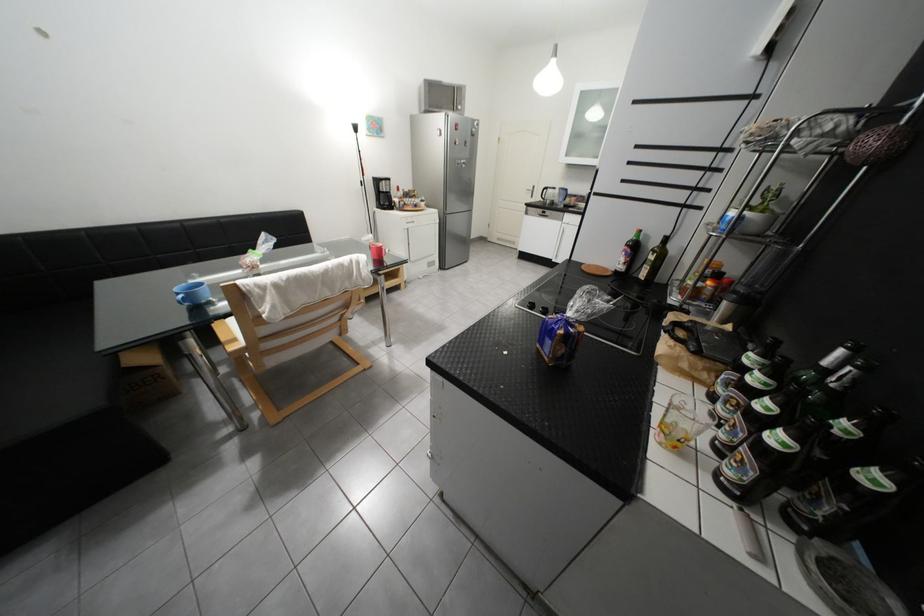
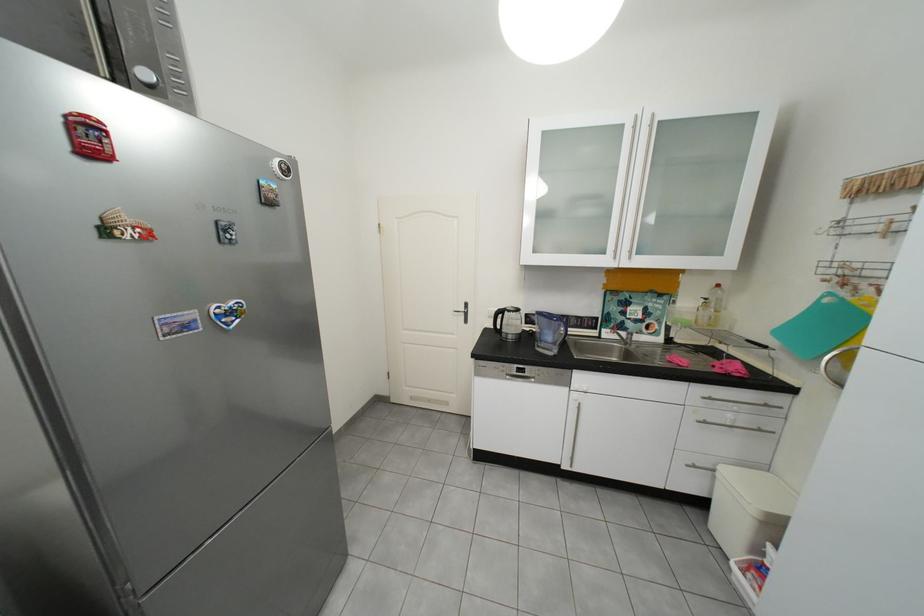
Find the pixel in the second image that matches (557,190) in the first image.

(513, 313)